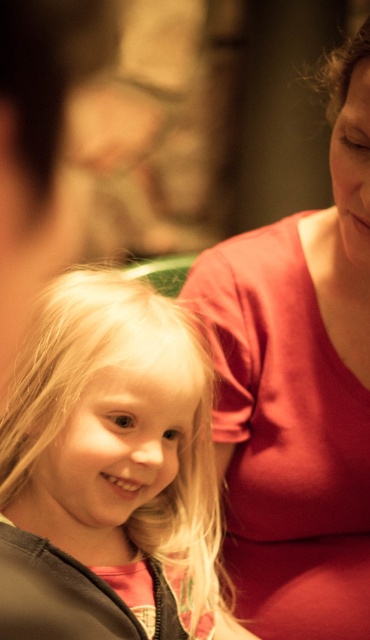
Looking at the image, where is the matte red shirt at upper right in relation to the blonde hair at center?

The matte red shirt at upper right is positioned to the right of the blonde hair at center.

You are standing in front of the image and want to know if the point at coordinate (x=362, y=420) is closer to you than the point at (x=227, y=634). Based on the scene description, can you determine which point is closer to the viewer?

Point (x=227, y=634) is closer to the viewer than point (x=362, y=420) because the description states that point (x=362, y=420) is behind point (x=227, y=634).

You are a photographer adjusting the lighting for a portrait. You need to ensure that the matte red shirt at upper right and the blonde hair at center are both well lit. Based on their positions, which object should you adjust the light to focus on first?

The matte red shirt at upper right is located above the blonde hair at center, so you should adjust the light to focus on the matte red shirt at upper right first to ensure proper lighting for both areas.